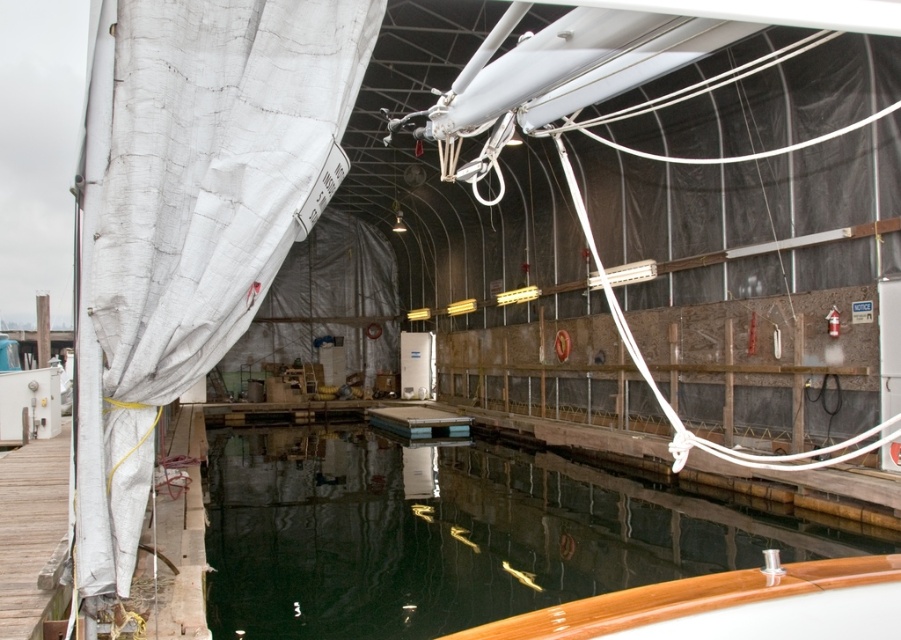
Does point (90, 250) lie in front of point (599, 611)?

Yes, point (90, 250) is closer to viewer.

Can you confirm if white fabric curtain at left is bigger than glossy wood boat at lower center?

Correct, white fabric curtain at left is larger in size than glossy wood boat at lower center.

Who is more forward, (272, 92) or (698, 602)?

Point (272, 92)

Find the location of `white fabric curtain at left`. white fabric curtain at left is located at coordinates (189, 216).

Which of these two, white fabric curtain at left or dark reflective water at center, stands taller?

With more height is white fabric curtain at left.

Is white fabric curtain at left wider than dark reflective water at center?

→ No, white fabric curtain at left is not wider than dark reflective water at center.

Is point (133, 24) behind point (633, 570)?

No, it is in front of (633, 570).

You are a GUI agent. You are given a task and a screenshot of the screen. Output one action in this format:
    pyautogui.click(x=<x>, y=<y>)
    Task: Click on the white fabric curtain at left
    The height and width of the screenshot is (640, 901).
    Given the screenshot: What is the action you would take?
    pyautogui.click(x=189, y=216)

Can you confirm if dark reflective water at center is wider than glossy wood boat at lower center?

Correct, the width of dark reflective water at center exceeds that of glossy wood boat at lower center.

Does dark reflective water at center come behind glossy wood boat at lower center?

Yes.

What are the coordinates of `dark reflective water at center` in the screenshot? It's located at (447, 534).